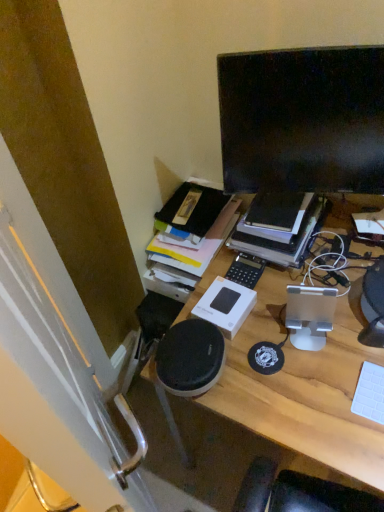
Question: Does black glossy monitor at upper right have a lesser width compared to wooden desk at center?

Choices:
 (A) yes
 (B) no

Answer: (A)

Question: Is the position of black glossy monitor at upper right less distant than that of wooden desk at center?

Choices:
 (A) yes
 (B) no

Answer: (B)

Question: Considering the relative sizes of black glossy monitor at upper right and wooden desk at center in the image provided, is black glossy monitor at upper right taller than wooden desk at center?

Choices:
 (A) yes
 (B) no

Answer: (B)

Question: Could you tell me if black glossy monitor at upper right is turned towards wooden desk at center?

Choices:
 (A) yes
 (B) no

Answer: (B)

Question: Is black glossy monitor at upper right wider than wooden desk at center?

Choices:
 (A) no
 (B) yes

Answer: (A)

Question: Considering their positions, is white matte keyboard at right located in front of or behind black glossy monitor at upper right?

Choices:
 (A) front
 (B) behind

Answer: (A)

Question: From a real-world perspective, is white matte keyboard at right positioned above or below black glossy monitor at upper right?

Choices:
 (A) above
 (B) below

Answer: (B)

Question: Based on their sizes in the image, would you say white matte keyboard at right is bigger or smaller than black glossy monitor at upper right?

Choices:
 (A) big
 (B) small

Answer: (B)

Question: Considering the positions of point (360, 392) and point (362, 185), is point (360, 392) closer or farther from the camera than point (362, 185)?

Choices:
 (A) farther
 (B) closer

Answer: (B)

Question: Is white matte keyboard at right bigger or smaller than wooden desk at center?

Choices:
 (A) big
 (B) small

Answer: (B)

Question: Is white matte keyboard at right inside the boundaries of wooden desk at center, or outside?

Choices:
 (A) inside
 (B) outside

Answer: (B)

Question: Is white matte keyboard at right taller or shorter than wooden desk at center?

Choices:
 (A) short
 (B) tall

Answer: (A)

Question: Considering the positions of white matte keyboard at right and wooden desk at center in the image, is white matte keyboard at right wider or thinner than wooden desk at center?

Choices:
 (A) wide
 (B) thin

Answer: (B)

Question: Is point (380, 373) closer or farther from the camera than point (236, 233)?

Choices:
 (A) closer
 (B) farther

Answer: (A)

Question: Is white matte keyboard at right spatially inside hardcover book at upper center, or outside of it?

Choices:
 (A) outside
 (B) inside

Answer: (A)